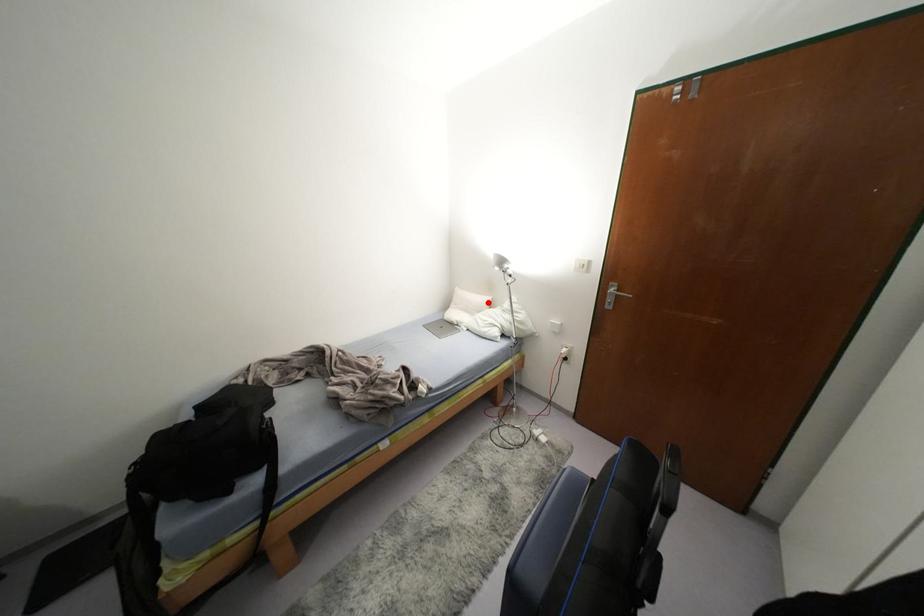
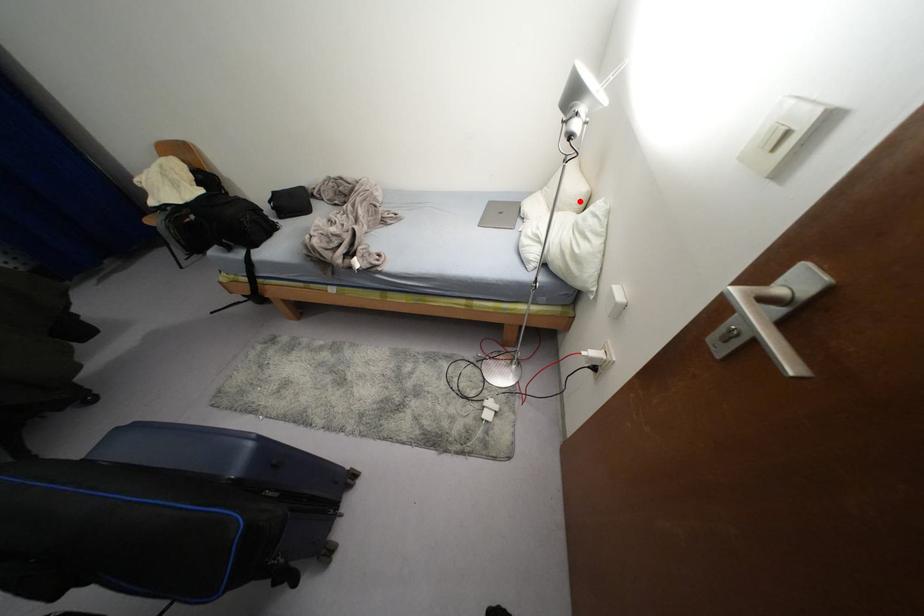
I am providing you with two images of the same scene from different viewpoints. A red point is marked on the first image and another point is marked on the second image. Do the highlighted points in image1 and image2 indicate the same real-world spot?

Yes